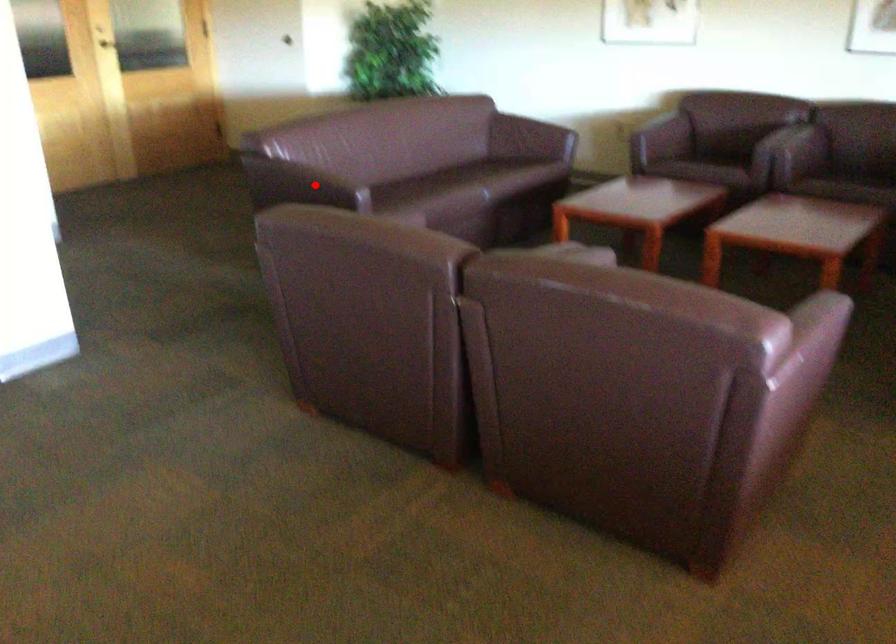
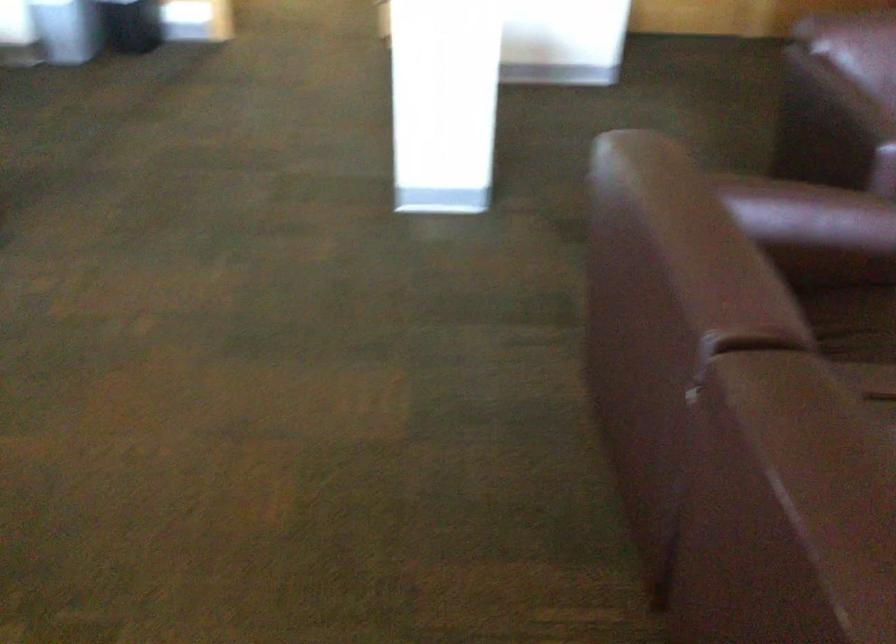
Locate, in the second image, the point that corresponds to the highlighted location in the first image.

(832, 118)